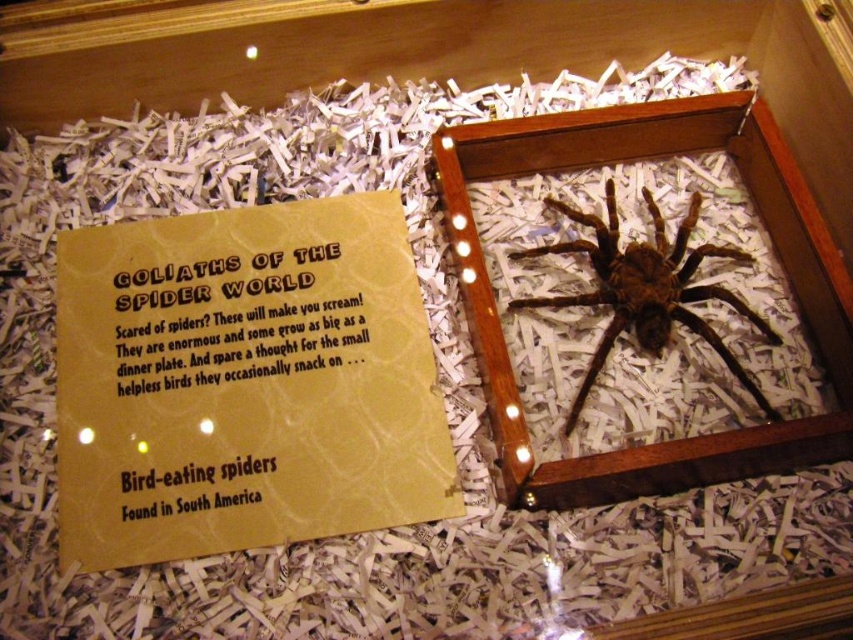
Question: Which point is closer to the camera?

Choices:
 (A) (67, 504)
 (B) (566, 134)
 (C) (546, 198)

Answer: (A)

Question: Can you confirm if wooden frame at center is thinner than brown paper sign at upper left?

Choices:
 (A) no
 (B) yes

Answer: (A)

Question: Does wooden frame at center appear on the right side of brown fuzzy spider at center?

Choices:
 (A) yes
 (B) no

Answer: (B)

Question: Which point is farther to the camera?

Choices:
 (A) brown fuzzy spider at center
 (B) yellow paper at center
 (C) wooden frame at center
 (D) brown paper sign at upper left

Answer: (D)

Question: Which point is farther to the camera?

Choices:
 (A) brown paper sign at upper left
 (B) brown fuzzy spider at center
 (C) yellow paper at center
 (D) wooden frame at center

Answer: (A)

Question: Observing the image, what is the correct spatial positioning of brown paper sign at upper left in reference to brown fuzzy spider at center?

Choices:
 (A) below
 (B) above

Answer: (A)